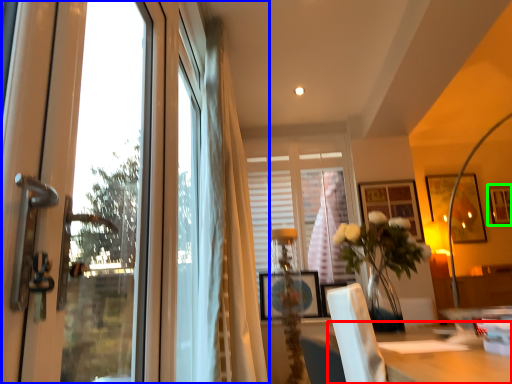
Question: Considering the real-world distances, which object is farthest from table (highlighted by a red box)? window (highlighted by a blue box) or picture frame (highlighted by a green box)?

Choices:
 (A) window
 (B) picture frame

Answer: (B)